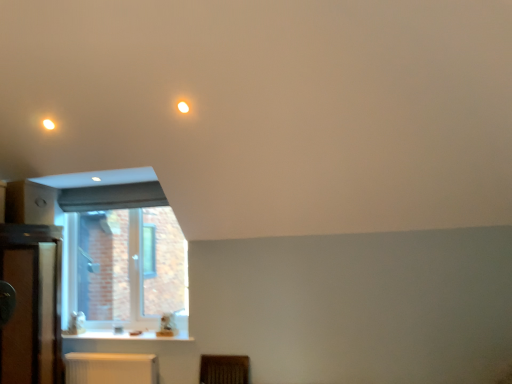
I want to click on vacant area on top of white glossy counter top at lower left (from a real-world perspective), so click(116, 337).